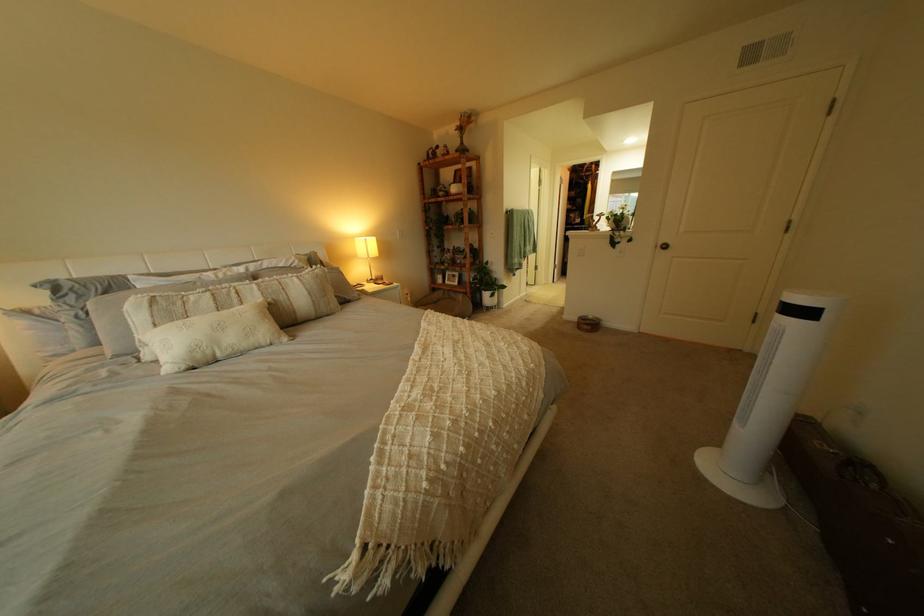
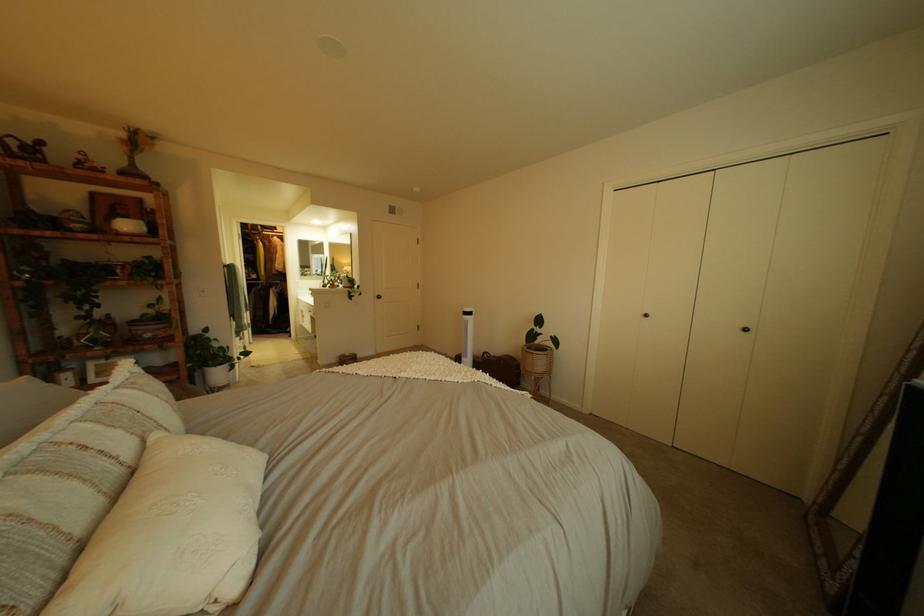
The point at [444,439] is marked in the first image. Where is the corresponding point in the second image?

(504, 376)